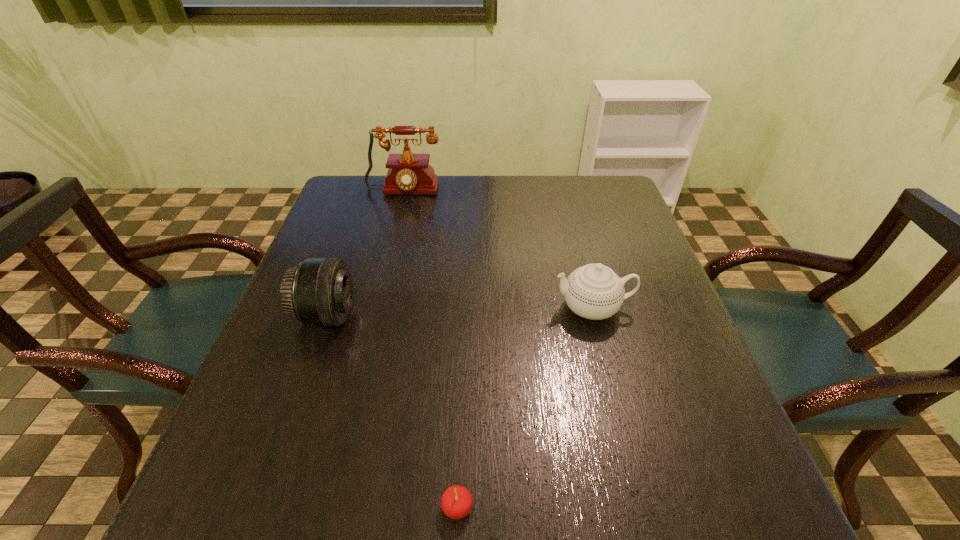
Identify the location of the tallest object. The height and width of the screenshot is (540, 960). (408, 173).

At what (x,y) coordinates should I click in order to perform the action: click on the farthest object. Please return your answer as a coordinate pair (x, y). Looking at the image, I should click on (408, 173).

At what (x,y) coordinates should I click in order to perform the action: click on telephoto lens. Please return your answer as a coordinate pair (x, y). Looking at the image, I should click on (x=319, y=291).

This screenshot has height=540, width=960. Find the location of `chinaware`. chinaware is located at coordinates (594, 291).

Find the location of a particular element. The width and height of the screenshot is (960, 540). the nearest object is located at coordinates (456, 502).

At what (x,y) coordinates should I click in order to perform the action: click on cherry. Please return your answer as a coordinate pair (x, y). The height and width of the screenshot is (540, 960). Looking at the image, I should click on (456, 502).

Identify the location of vacant space located on the dial of the tallest object. This screenshot has width=960, height=540. (379, 288).

Where is `free spot located on the front-facing side of the telephoto lens`? The height and width of the screenshot is (540, 960). free spot located on the front-facing side of the telephoto lens is located at coordinates (391, 315).

Image resolution: width=960 pixels, height=540 pixels. What are the coordinates of `vacant space located on the spout of the chinaware` in the screenshot? It's located at (526, 308).

The height and width of the screenshot is (540, 960). I want to click on free space located on the spout of the chinaware, so click(472, 308).